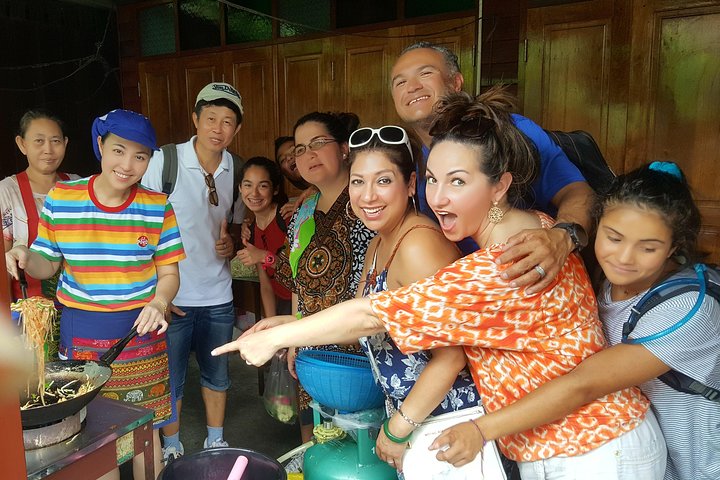
The width and height of the screenshot is (720, 480). I want to click on black floor, so click(x=266, y=436).